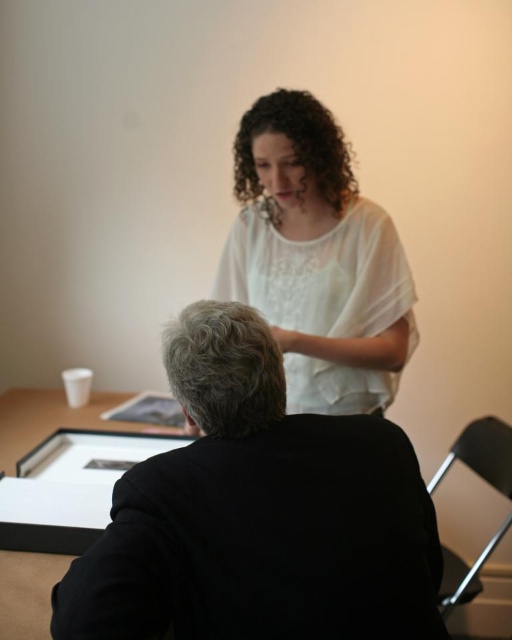
You are an observer in the room. You see the gray curly hair at center and the curly brown hair at upper center. Which one appears lower in height?

The gray curly hair at center has a lesser height compared to the curly brown hair at upper center, so the gray curly hair at center appears lower in height.

You are a photographer standing 34.28 inches away from the gray curly hair at center. You want to take a photo of the seated person with the framed item on the table. Is your current distance sufficient to capture the entire scene in one frame?

The gray curly hair at center and camera are 34.28 inches apart. Since the seated person and the framed item are within this distance, the photographer can capture the entire scene in one frame.

You are an observer in the room. You notice the white sheer blouse at upper center and the curly brown hair at upper center. Which object takes up more space in the image?

The white sheer blouse at upper center is larger in size than the curly brown hair at upper center, so it takes up more space in the image.